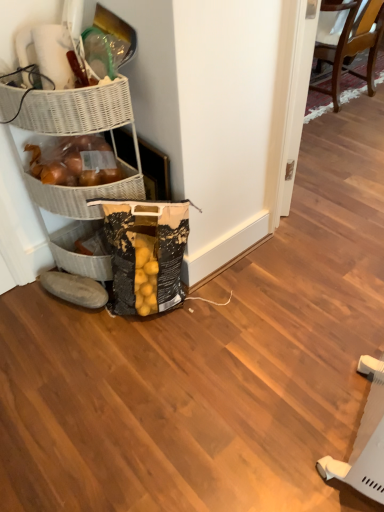
Where is `vacant area to the left of gray fabric slipper at lower left`? This screenshot has height=512, width=384. vacant area to the left of gray fabric slipper at lower left is located at coordinates (28, 309).